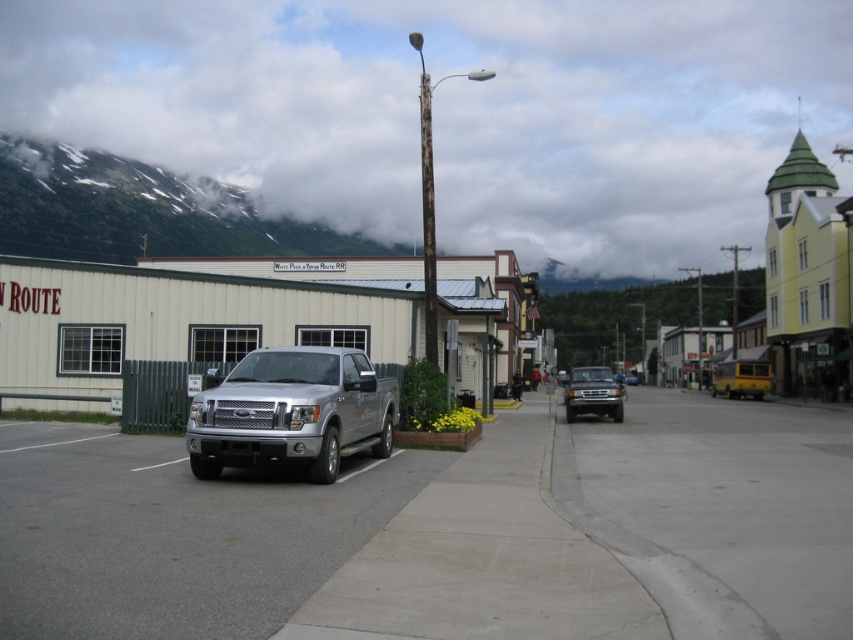
Between point (13, 636) and point (769, 369), which one is positioned behind?

The point (769, 369) is behind.

Who is more forward, (25, 561) or (726, 365)?

Point (25, 561) is in front.

You are a GUI agent. You are given a task and a screenshot of the screen. Output one action in this format:
    pyautogui.click(x=<x>, y=<y>)
    Task: Click on the gray asphalt pavement at center
    
    Given the screenshot: What is the action you would take?
    pyautogui.click(x=172, y=534)

Can you confirm if gray concrete pavement at center is bigger than metallic silver truck at center?

No, gray concrete pavement at center is not bigger than metallic silver truck at center.

Is point (726, 563) farther from viewer compared to point (575, 372)?

No.

Identify the location of gray concrete pavement at center. The width and height of the screenshot is (853, 640). (720, 509).

Which is behind, point (315, 248) or point (729, 378)?

Positioned behind is point (315, 248).

Is green rocky mountain at upper left positioned before yellow matte bus at center?

No, green rocky mountain at upper left is behind yellow matte bus at center.

Is point (267, 244) closer to camera compared to point (741, 358)?

That is False.

At what (x,y) coordinates should I click in order to perform the action: click on green rocky mountain at upper left. Please return your answer as a coordinate pair (x, y). This screenshot has width=853, height=640. Looking at the image, I should click on (140, 211).